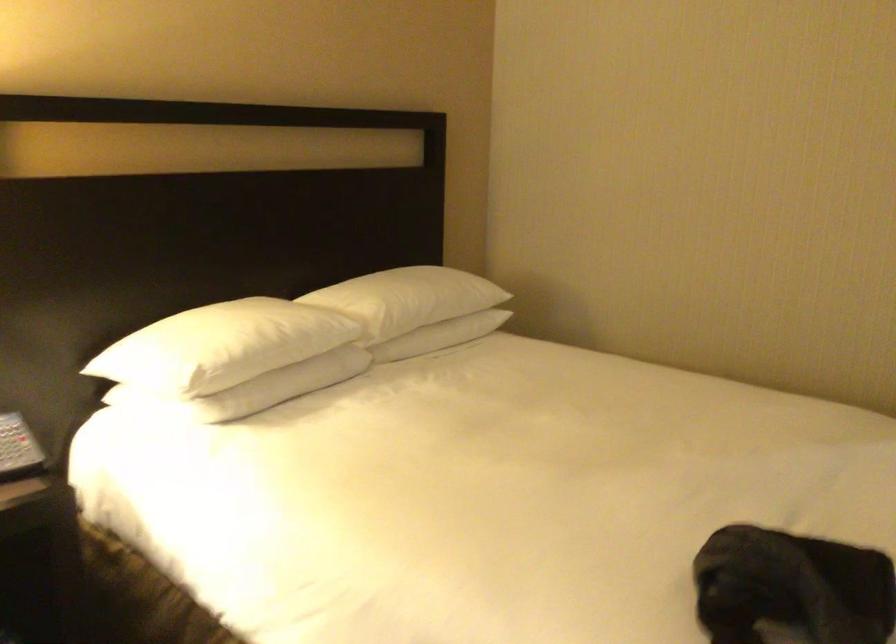
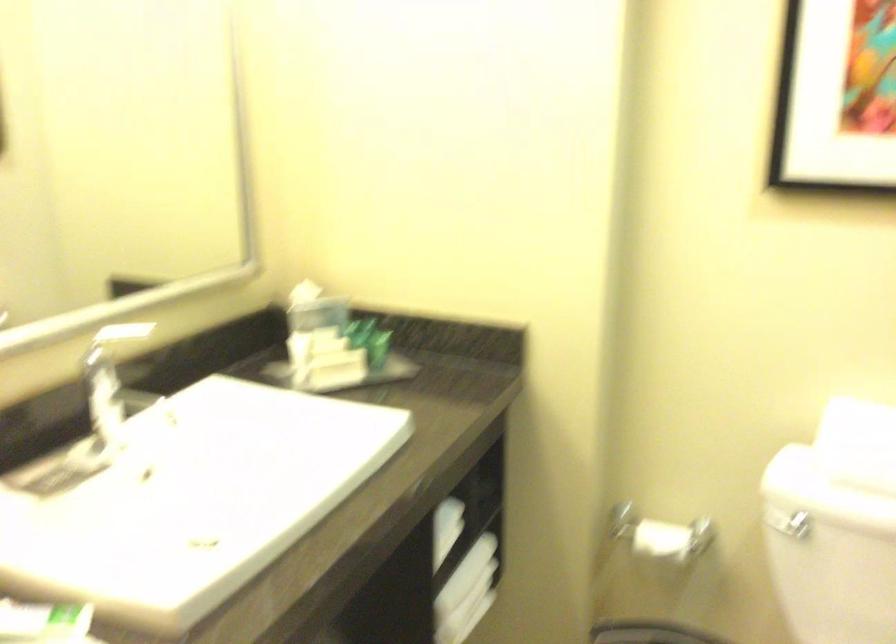
The point at (811,263) is marked in the first image. Where is the corresponding point in the second image?

(115, 339)